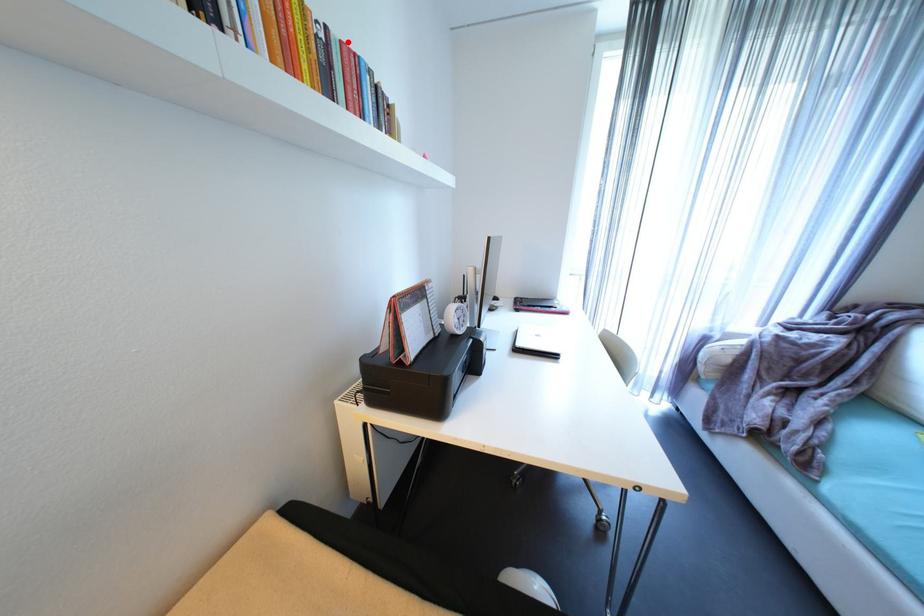
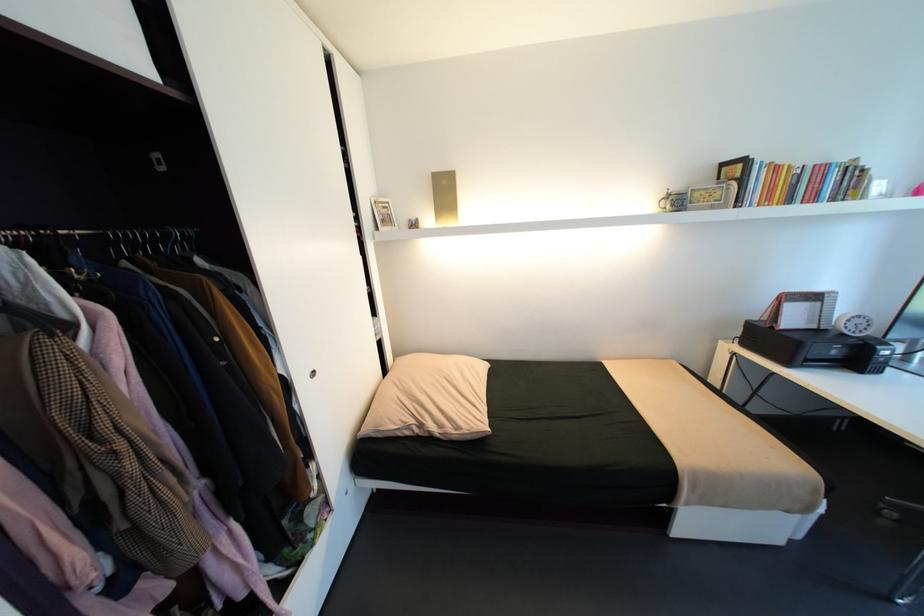
In the second image, find the point that corresponds to the highlighted location in the first image.

(821, 166)